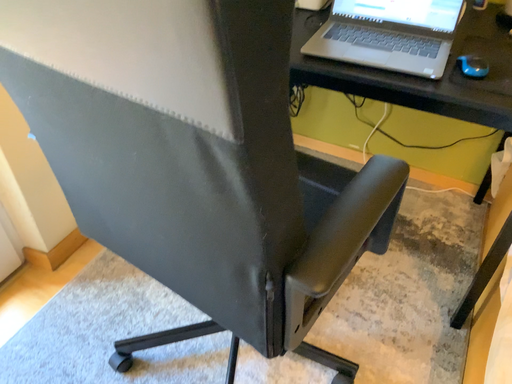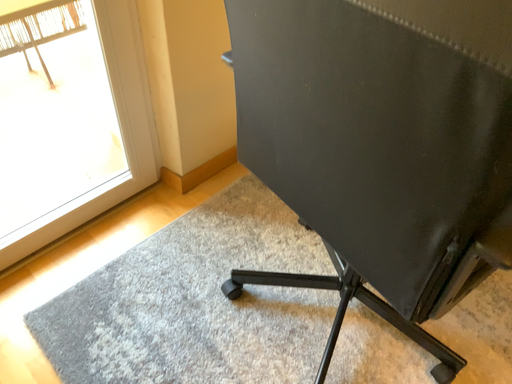
Question: How did the camera likely rotate when shooting the video?

Choices:
 (A) rotated right
 (B) rotated left

Answer: (B)